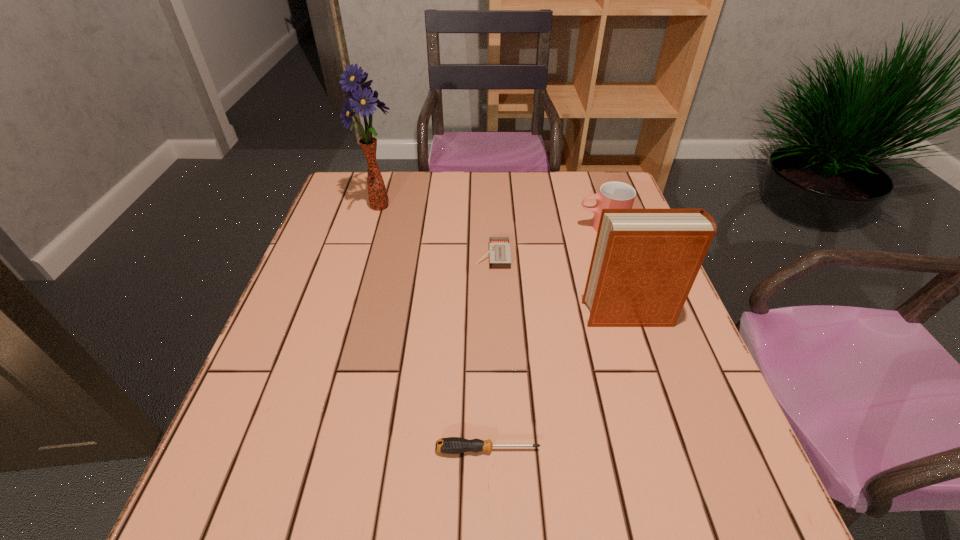
What are the coordinates of `free region located 0.300m on the open cover of the fourth shortest object` in the screenshot? It's located at (451, 315).

At what (x,y) coordinates should I click in order to perform the action: click on vacant position located on the side of the cup with the handle. Please return your answer as a coordinate pair (x, y). Image resolution: width=960 pixels, height=540 pixels. Looking at the image, I should click on (467, 227).

Identify the location of vacant space situated 0.160m on the side of the cup with the handle. (520, 227).

Identify the location of vacant space situated on the side of the cup with the handle. (495, 227).

In order to click on free space located 0.100m on the striking surface of the third farthest object in this screenshot , I will do `click(437, 256)`.

Where is `free location located on the striking surface of the third farthest object`? The image size is (960, 540). free location located on the striking surface of the third farthest object is located at coordinates (364, 256).

Find the location of `vacant space situated on the striking surface of the third farthest object`. vacant space situated on the striking surface of the third farthest object is located at coordinates (433, 256).

Find the location of a particular element. vacant area situated on the left of the nearest object is located at coordinates (228, 449).

Where is `object situated at the far edge`? The width and height of the screenshot is (960, 540). object situated at the far edge is located at coordinates (363, 99).

At what (x,y) coordinates should I click in order to perform the action: click on object that is at the left edge. Please return your answer as a coordinate pair (x, y). Looking at the image, I should click on (363, 99).